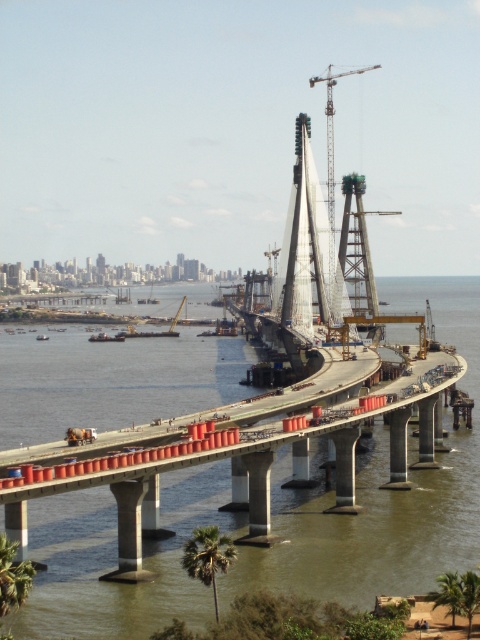
Between concrete bridge at center and metallic gray crane at center, which one appears on the left side from the viewer's perspective?

concrete bridge at center is more to the left.

Can you confirm if concrete bridge at center is thinner than metallic gray crane at center?

No.

Which is behind, point (45, 412) or point (330, 266)?

Point (330, 266)

What are the coordinates of `concrete bridge at center` in the screenshot? It's located at (110, 380).

Does concrete bridge at center appear over green leafy palm tree at lower center?

Indeed, concrete bridge at center is positioned over green leafy palm tree at lower center.

Who is higher up, concrete bridge at center or green leafy palm tree at lower center?

Positioned higher is concrete bridge at center.

Where is `concrete bridge at center`? This screenshot has height=640, width=480. concrete bridge at center is located at coordinates (110, 380).

Image resolution: width=480 pixels, height=640 pixels. In order to click on concrete bridge at center in this screenshot , I will do (x=110, y=380).

Between green leafy palm tree at lower center and green leafy palm tree at lower left, which one appears on the left side from the viewer's perspective?

green leafy palm tree at lower left is more to the left.

Who is higher up, green leafy palm tree at lower center or green leafy palm tree at lower left?

green leafy palm tree at lower left

Is point (195, 547) farther from camera compared to point (1, 576)?

Yes, point (195, 547) is farther from viewer.

You are a GUI agent. You are given a task and a screenshot of the screen. Output one action in this format:
    pyautogui.click(x=<x>, y=<y>)
    Task: Click on the green leafy palm tree at lower center
    This screenshot has width=480, height=640.
    Given the screenshot: What is the action you would take?
    pyautogui.click(x=207, y=556)